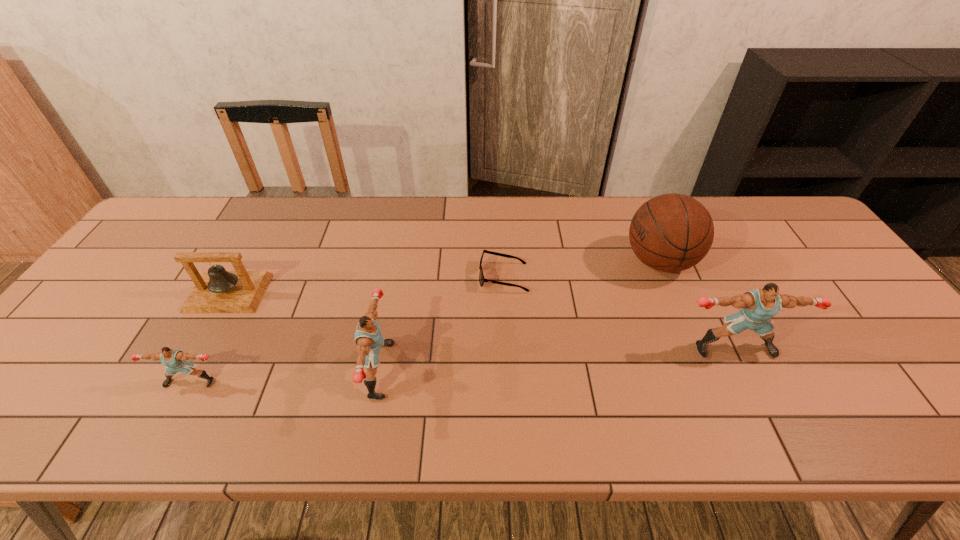
Identify the location of free space located 0.220m on the front-facing side of the fourth object from left to right. This screenshot has height=540, width=960. (400, 277).

I want to click on vacant space located 0.370m on the front-facing side of the fourth object from left to right, so click(346, 277).

At what (x,y) coordinates should I click in order to perform the action: click on vacant space located on the front-facing side of the fourth object from left to right. Please return your answer as a coordinate pair (x, y). This screenshot has width=960, height=540. Looking at the image, I should click on (446, 277).

The height and width of the screenshot is (540, 960). What are the coordinates of `free region located on the side with brand label of the basketball` in the screenshot? It's located at (540, 262).

What are the coordinates of `free spot located on the side with brand label of the basketball` in the screenshot? It's located at (522, 262).

This screenshot has width=960, height=540. Find the location of `free space located 0.210m on the side with brand label of the basketball`. free space located 0.210m on the side with brand label of the basketball is located at coordinates (549, 262).

You are a GUI agent. You are given a task and a screenshot of the screen. Output one action in this format:
    pyautogui.click(x=<x>, y=<y>)
    Task: Click on the vacant space located on the back of the bell
    
    Given the screenshot: What is the action you would take?
    pyautogui.click(x=280, y=199)

What are the coordinates of `object present at the far edge` in the screenshot? It's located at (671, 232).

Image resolution: width=960 pixels, height=540 pixels. In the image, there is a desktop. In order to click on free region at the far edge in this screenshot , I will do `click(320, 232)`.

This screenshot has height=540, width=960. Identify the location of free region at the near edge of the desktop. (238, 368).